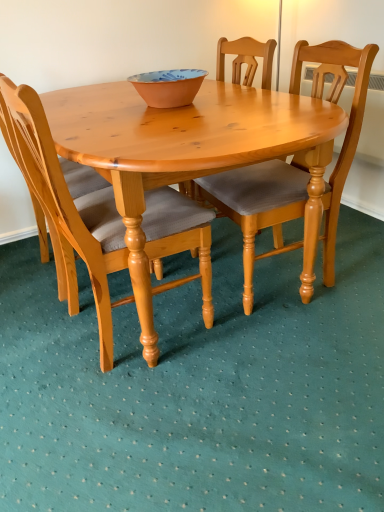
Identify the location of free space above terracotta ceramic bowl at center (from a real-world perspective). (169, 73).